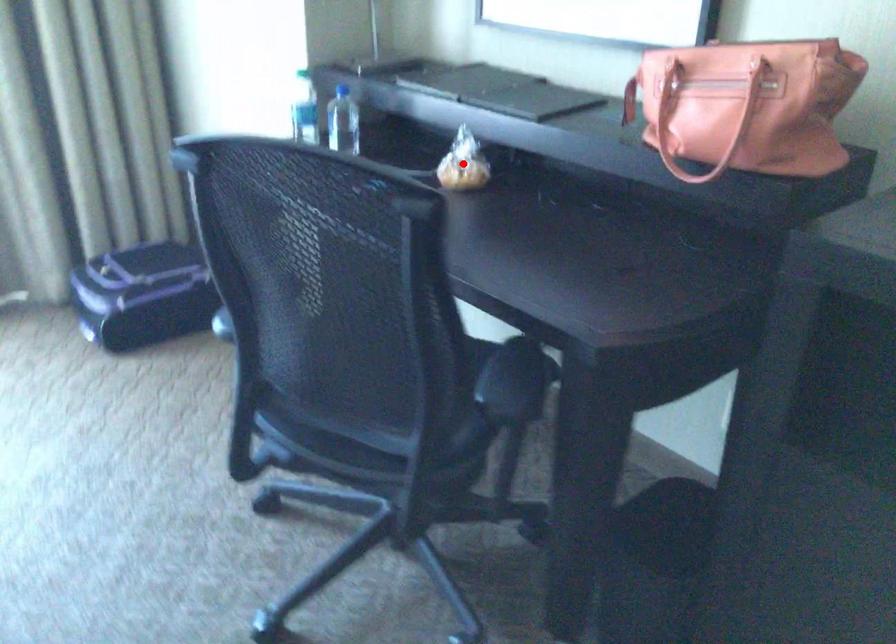
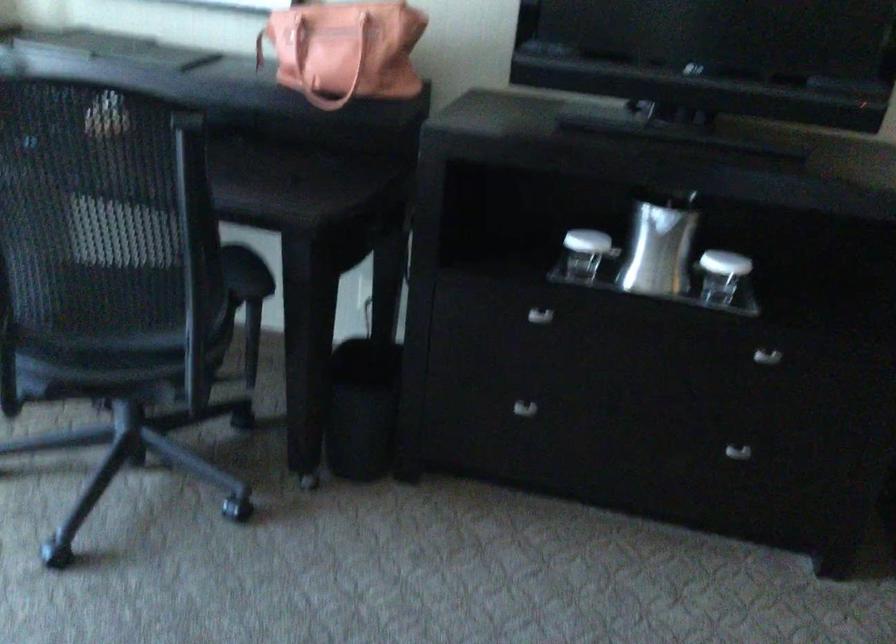
Question: I am providing you with two images of the same scene from different viewpoints. A red point is marked on the first image. Can you still see the location of the red point in image 2?

Choices:
 (A) Yes
 (B) No

Answer: (B)